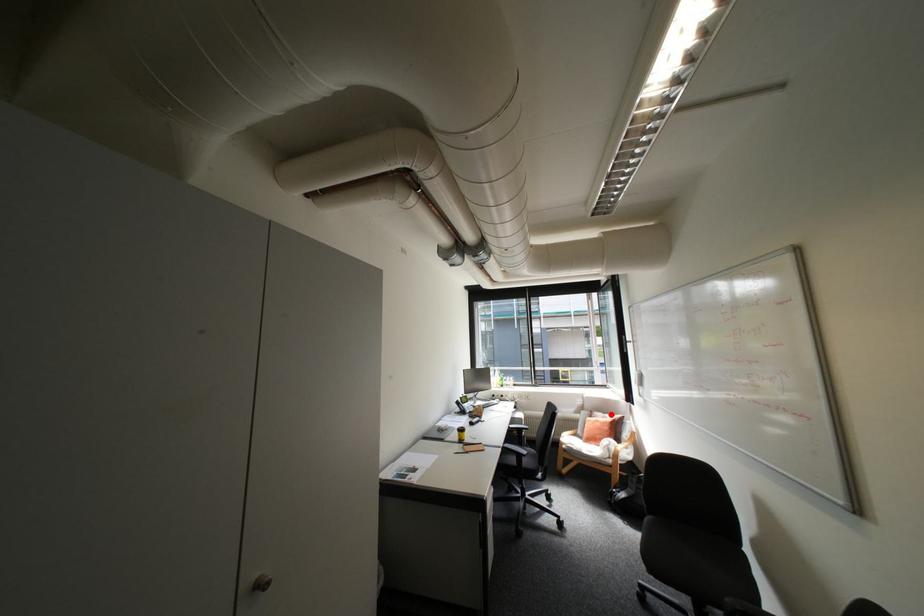
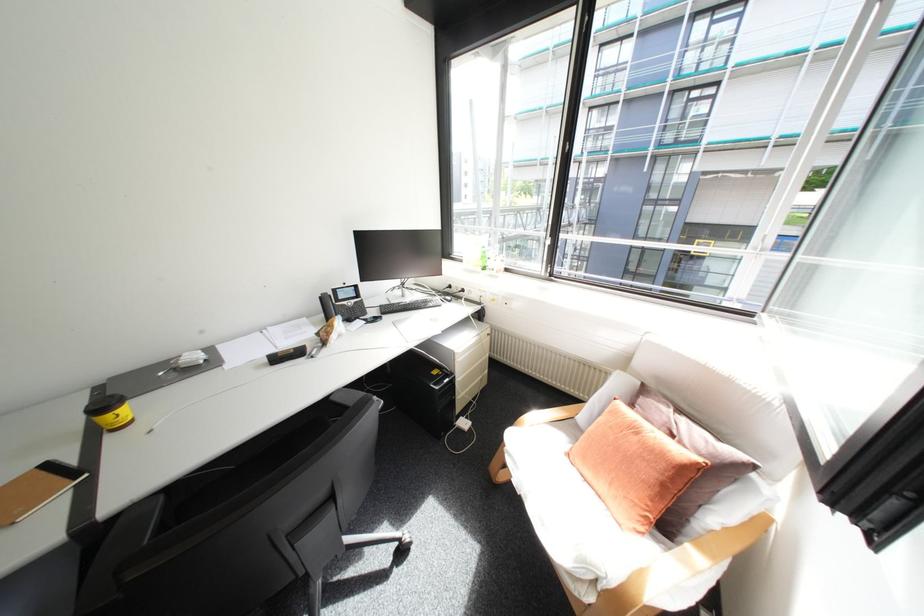
Question: I am providing you with two images of the same scene from different viewpoints. Image1 has a red point marked. In image2, the corresponding 3D location appears at what relative position? Reply with the corresponding letter.

Choices:
 (A) Closer
 (B) Farther

Answer: (A)